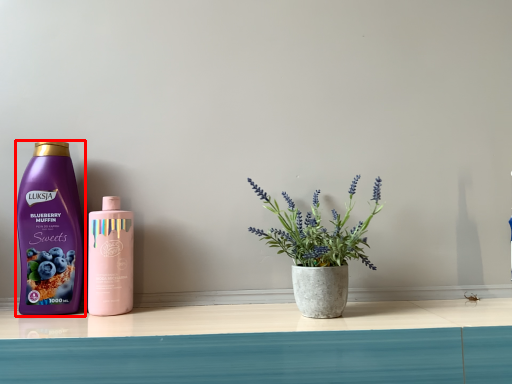
Question: Where is bottle (annotated by the red box) located in relation to bottle in the image?

Choices:
 (A) right
 (B) left

Answer: (B)